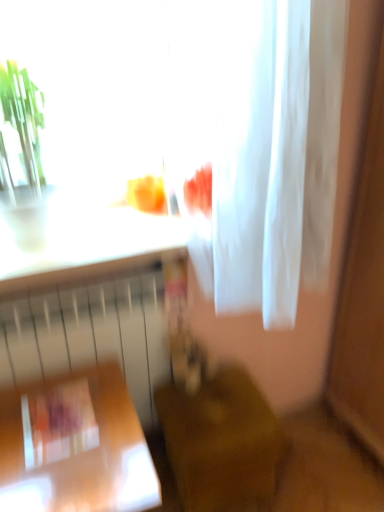
Question: From the image's perspective, relative to wooden chair at lower center, which is the 2th furniture from left to right, is wooden table at lower left, positioned as the first furniture in left-to-right order, above or below?

Choices:
 (A) below
 (B) above

Answer: (A)

Question: Considering the positions of wooden table at lower left, positioned as the first furniture in left-to-right order, and wooden chair at lower center, which is counted as the 1th furniture, starting from the right, in the image, is wooden table at lower left, positioned as the first furniture in left-to-right order, wider or thinner than wooden chair at lower center, which is counted as the 1th furniture, starting from the right,?

Choices:
 (A) wide
 (B) thin

Answer: (A)

Question: Considering the real-world distances, which object is farthest from the white sheer fabric at upper center?

Choices:
 (A) matte plastic book at lower left
 (B) wooden chair at lower center, which is counted as the 1th furniture, starting from the right
 (C) white matte radiator at lower left
 (D) wooden table at lower left, the second furniture viewed from the right

Answer: (A)

Question: Which object is positioned farthest from the matte plastic book at lower left?

Choices:
 (A) white sheer fabric at upper center
 (B) wooden chair at lower center, which is the 2th furniture from left to right
 (C) white matte radiator at lower left
 (D) wooden table at lower left, positioned as the first furniture in left-to-right order

Answer: (A)